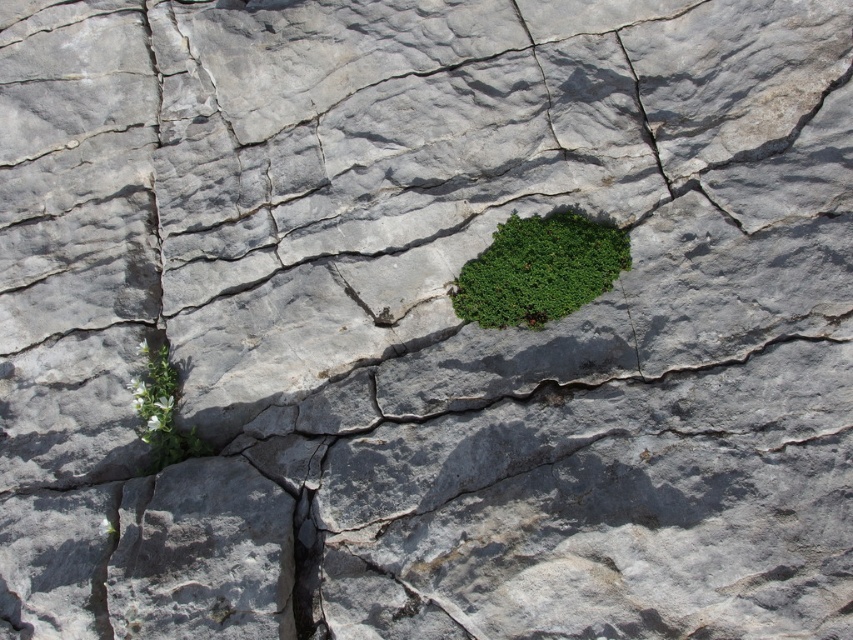
Question: Where is green leafy plant at center located in relation to smooth dark gray rock at bottom center in the image?

Choices:
 (A) left
 (B) right

Answer: (B)

Question: Which of these objects is positioned farthest from the green leafy plant at center?

Choices:
 (A) smooth dark gray rock at bottom center
 (B) green leafy plant at lower left

Answer: (B)

Question: Is green leafy plant at center above smooth dark gray rock at bottom center?

Choices:
 (A) no
 (B) yes

Answer: (B)

Question: Is green leafy plant at center thinner than smooth dark gray rock at bottom center?

Choices:
 (A) yes
 (B) no

Answer: (B)

Question: Which point is farther to the camera?

Choices:
 (A) green leafy plant at center
 (B) smooth dark gray rock at bottom center

Answer: (A)

Question: Which object is positioned closest to the green leafy plant at center?

Choices:
 (A) green leafy plant at lower left
 (B) smooth dark gray rock at bottom center

Answer: (B)